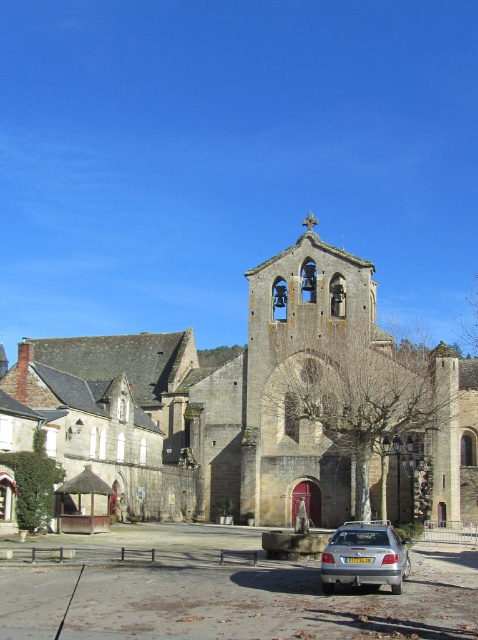
You are a photographer planning to take a wide shot of the stone church at center and the silver metallic car at lower center. Given their sizes, which object should you prioritize positioning closer to the camera to ensure both are clearly visible in the frame?

The stone church at center is larger than the silver metallic car at lower center, so positioning the car closer to the camera would help balance their sizes in the frame, ensuring both are clearly visible.